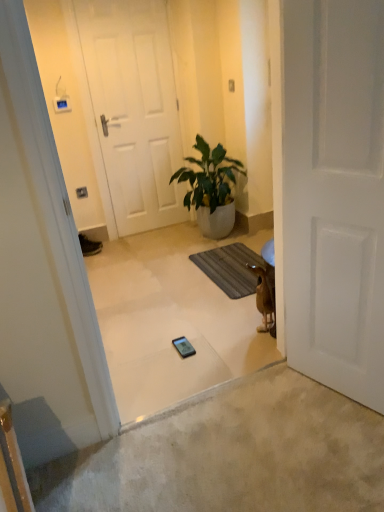
Where is `blank space to the left of green glossy plant at center`? The image size is (384, 512). blank space to the left of green glossy plant at center is located at coordinates (160, 242).